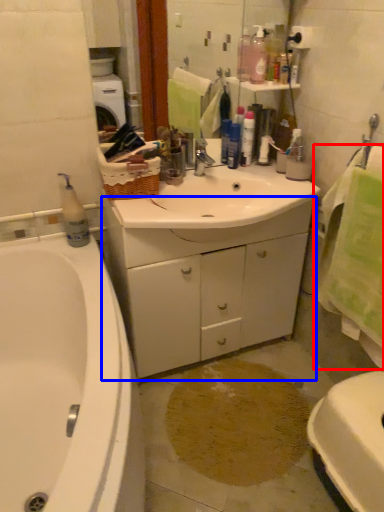
Question: Which of the following is the closest to the observer, bath towel (highlighted by a red box) or cabinetry (highlighted by a blue box)?

Choices:
 (A) bath towel
 (B) cabinetry

Answer: (A)